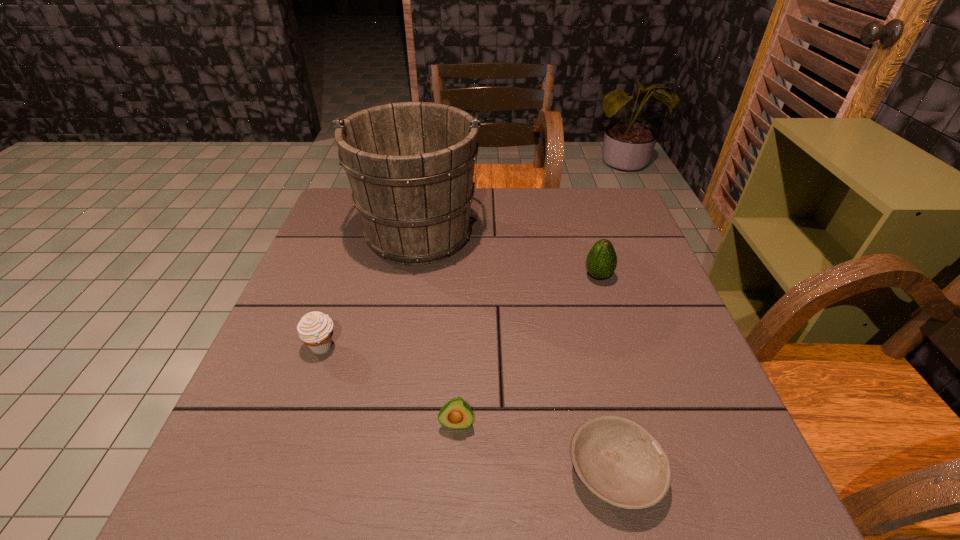
This screenshot has width=960, height=540. In the image, there is a desktop. Find the location of `vacant space at the near edge`. vacant space at the near edge is located at coordinates (565, 497).

Image resolution: width=960 pixels, height=540 pixels. Find the location of `free space at the left edge of the desktop`. free space at the left edge of the desktop is located at coordinates (341, 247).

The image size is (960, 540). In the image, there is a desktop. Identify the location of vacant area at the right edge. (662, 308).

The height and width of the screenshot is (540, 960). I want to click on vacant space at the far left corner of the desktop, so click(342, 207).

In the image, there is a desktop. Identify the location of vacant space at the far right corner. (611, 197).

You are a GUI agent. You are given a task and a screenshot of the screen. Output one action in this format:
    pyautogui.click(x=<x>, y=<y>)
    Task: Click on the empty space that is in between the tallest object and the third farthest object
    
    Given the screenshot: What is the action you would take?
    pyautogui.click(x=371, y=289)

Where is `free space between the bucket and the shorter avocado`? The image size is (960, 540). free space between the bucket and the shorter avocado is located at coordinates (438, 328).

Identify the location of vacant space that is in between the muffin and the nearer avocado. Image resolution: width=960 pixels, height=540 pixels. (390, 385).

I want to click on free spot between the third farthest object and the shorter avocado, so click(x=390, y=385).

This screenshot has width=960, height=540. Identify the location of vacant area between the left avocado and the third farthest object. (390, 385).